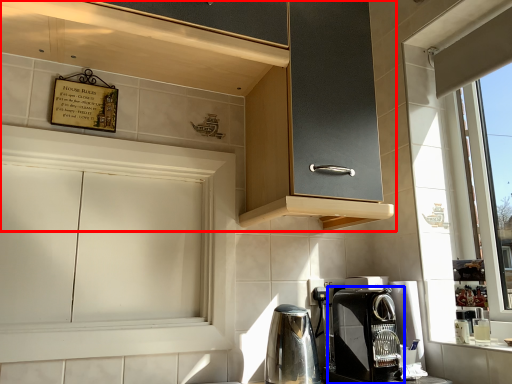
Question: Among these objects, which one is farthest to the camera, cabinetry (highlighted by a red box) or coffee maker (highlighted by a blue box)?

Choices:
 (A) cabinetry
 (B) coffee maker

Answer: (B)